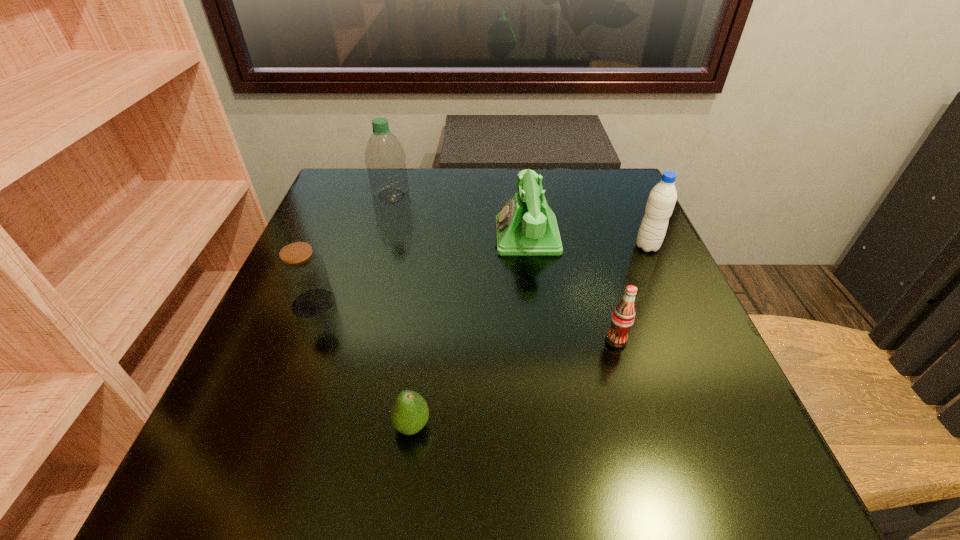
Locate an element on the screen. This screenshot has width=960, height=540. avocado is located at coordinates (409, 413).

Identify the location of vacant space situated on the front of the farthest object. (379, 239).

Identify the location of vacant region located on the left of the nearer water bottle. (487, 246).

I want to click on free space located on the dial of the telephone, so click(x=351, y=236).

Locate an element on the screen. blank space located on the dial of the telephone is located at coordinates (315, 236).

You are a GUI agent. You are given a task and a screenshot of the screen. Output one action in this format:
    pyautogui.click(x=<x>, y=<y>)
    Task: Click on the vacant space located 0.170m on the dial of the telephone
    The height and width of the screenshot is (540, 960).
    Given the screenshot: What is the action you would take?
    419,236

Identify the location of free region located 0.320m on the front of the jar. (234, 505).

Identify the location of vacant space located 0.400m on the back of the fifth object from left to right. This screenshot has width=960, height=540. (577, 206).

Identify the location of free space located 0.090m on the back of the avocado. (420, 361).

At what (x,y) coordinates should I click in order to perform the action: click on water bottle situated at the far edge. Please return your answer as a coordinate pair (x, y). Image resolution: width=960 pixels, height=540 pixels. Looking at the image, I should click on (385, 159).